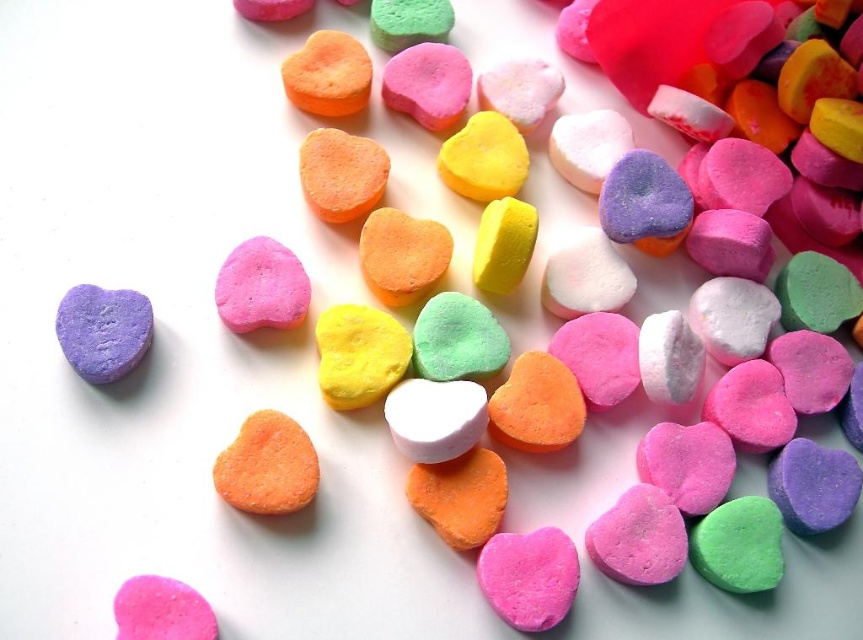
Question: In this image, where is pink matte heart at center located relative to matte pink heart at center?

Choices:
 (A) below
 (B) above

Answer: (A)

Question: Observing the image, what is the correct spatial positioning of matte purple heart at left in reference to pink matte heart at lower left?

Choices:
 (A) above
 (B) below

Answer: (A)

Question: Can you confirm if pink matte heart at center is positioned above matte purple heart at left?

Choices:
 (A) no
 (B) yes

Answer: (A)

Question: Which object is positioned farthest from the pink matte heart at lower left?

Choices:
 (A) pink matte heart at center
 (B) matte pink heart at center

Answer: (A)

Question: Which object is the closest to the matte purple heart at left?

Choices:
 (A) matte pink heart at center
 (B) pink matte heart at lower left
 (C) pink matte heart at center

Answer: (A)

Question: Which of the following is the closest to the observer?

Choices:
 (A) matte pink heart at center
 (B) pink matte heart at lower left

Answer: (B)